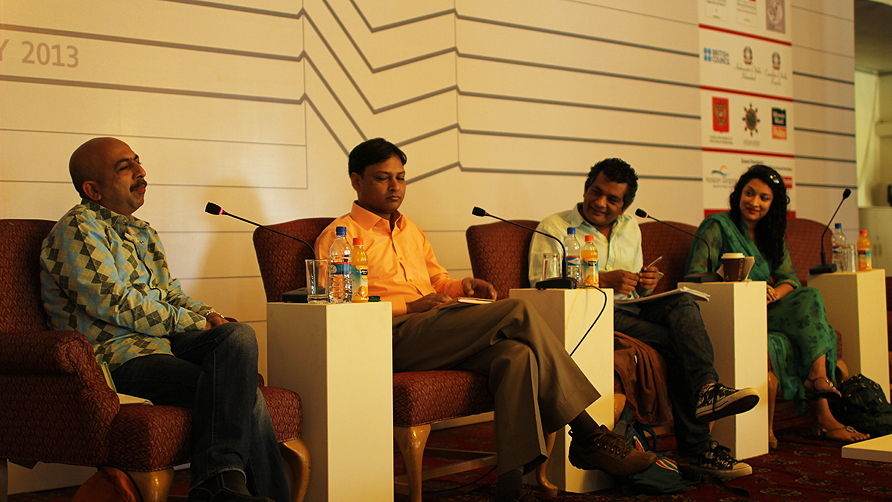
The image size is (892, 502). What are the coordinates of `1 mic on the left` in the screenshot? It's located at (243, 217).